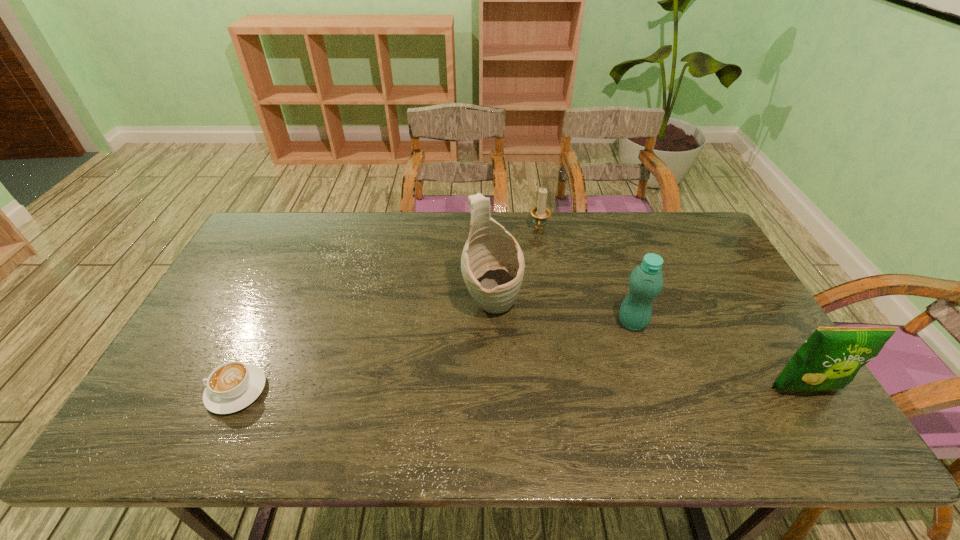
Identify the location of object that is at the far edge. (540, 213).

Find the location of a particular element. Image resolution: width=960 pixels, height=540 pixels. cappuccino positioned at the near edge is located at coordinates (232, 386).

Find the location of a particular element. The width and height of the screenshot is (960, 540). crisp (potato chip) situated at the near edge is located at coordinates coord(830,358).

You are a GUI agent. You are given a task and a screenshot of the screen. Output one action in this format:
    pyautogui.click(x=<x>, y=<y>)
    Task: Click on the object at the left edge
    This screenshot has height=540, width=960.
    Given the screenshot: What is the action you would take?
    pyautogui.click(x=232, y=386)

Where is `object at the right edge`? object at the right edge is located at coordinates (830, 358).

I want to click on object located in the near left corner section of the desktop, so click(232, 386).

Locate an element on the screen. object positioned at the near right corner is located at coordinates (830, 358).

Where is `vacant area at the far edge of the desktop`? The width and height of the screenshot is (960, 540). vacant area at the far edge of the desktop is located at coordinates (300, 236).

Image resolution: width=960 pixels, height=540 pixels. In order to click on blank space at the near edge of the desktop in this screenshot , I will do `click(330, 394)`.

Locate an element on the screen. This screenshot has width=960, height=540. vacant space at the right edge is located at coordinates (710, 301).